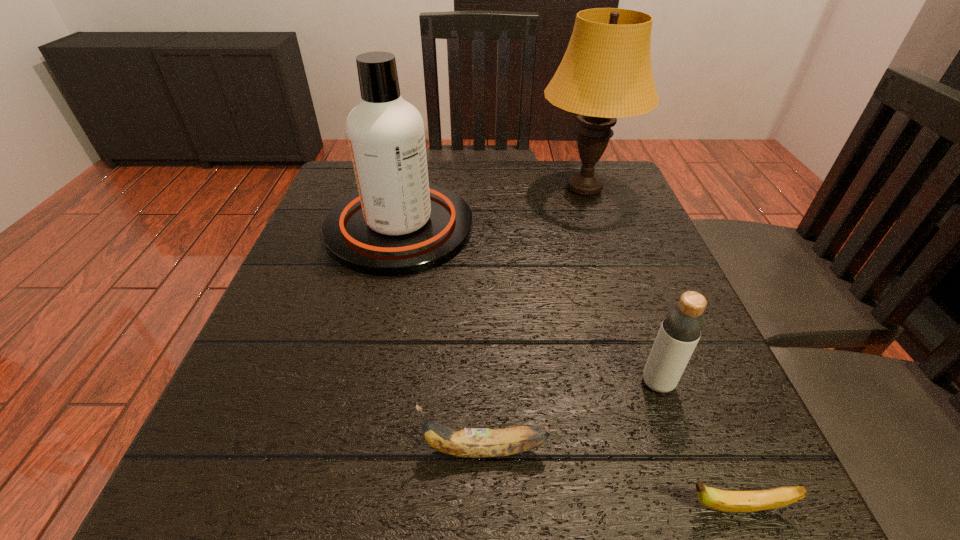
Locate an element on the screen. free point at the far left corner is located at coordinates (336, 167).

In the image, there is a desktop. Where is `vacant region at the far right corner`? vacant region at the far right corner is located at coordinates (616, 161).

You are a GUI agent. You are given a task and a screenshot of the screen. Output one action in this format:
    pyautogui.click(x=<x>, y=<y>)
    Task: Click on the empty space that is in between the taller banana and the nearer banana
    Image resolution: width=960 pixels, height=540 pixels.
    Given the screenshot: What is the action you would take?
    pyautogui.click(x=610, y=479)

The image size is (960, 540). In order to click on free space between the third nearest object and the fourth farthest object in this screenshot , I will do `click(571, 416)`.

Where is `vacant space that's between the cleansing agent and the lampshade`? vacant space that's between the cleansing agent and the lampshade is located at coordinates (492, 207).

Find the location of `free spot between the cleansing agent and the shortest object`. free spot between the cleansing agent and the shortest object is located at coordinates (567, 368).

Identify the location of vacant area between the bottle and the shortest object. (696, 445).

What are the coordinates of `free spot between the cleansing agent and the fourth farthest object` in the screenshot? It's located at (443, 339).

The height and width of the screenshot is (540, 960). Find the location of `blank region between the left banana and the cleansing agent`. blank region between the left banana and the cleansing agent is located at coordinates (443, 339).

You are a GUI agent. You are given a task and a screenshot of the screen. Output one action in this format:
    pyautogui.click(x=<x>, y=<y>)
    Task: Click on the free space between the cleansing agent and the farther banana
    This screenshot has height=540, width=960.
    Given the screenshot: What is the action you would take?
    pyautogui.click(x=443, y=339)